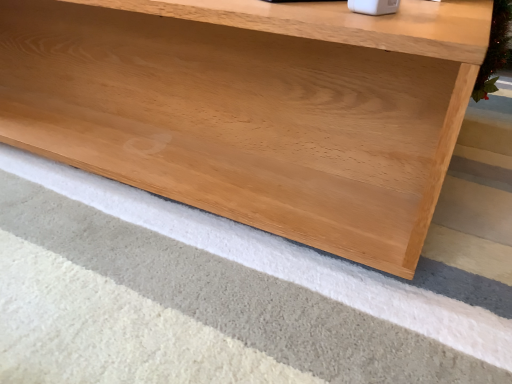
Locate an element on the screen. This screenshot has height=384, width=512. natural wood shelf at lower center is located at coordinates (253, 108).

Describe the element at coordinates (253, 108) in the screenshot. The width and height of the screenshot is (512, 384). I see `natural wood shelf at lower center` at that location.

Measure the distance between point (436, 150) and camera.

A distance of 50.30 centimeters exists between point (436, 150) and camera.

I want to click on natural wood shelf at lower center, so click(x=253, y=108).